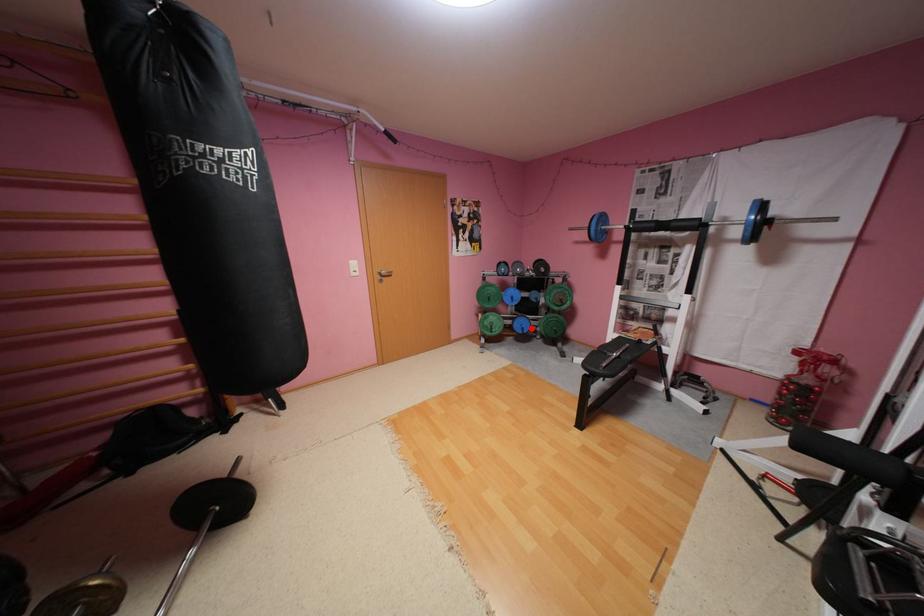
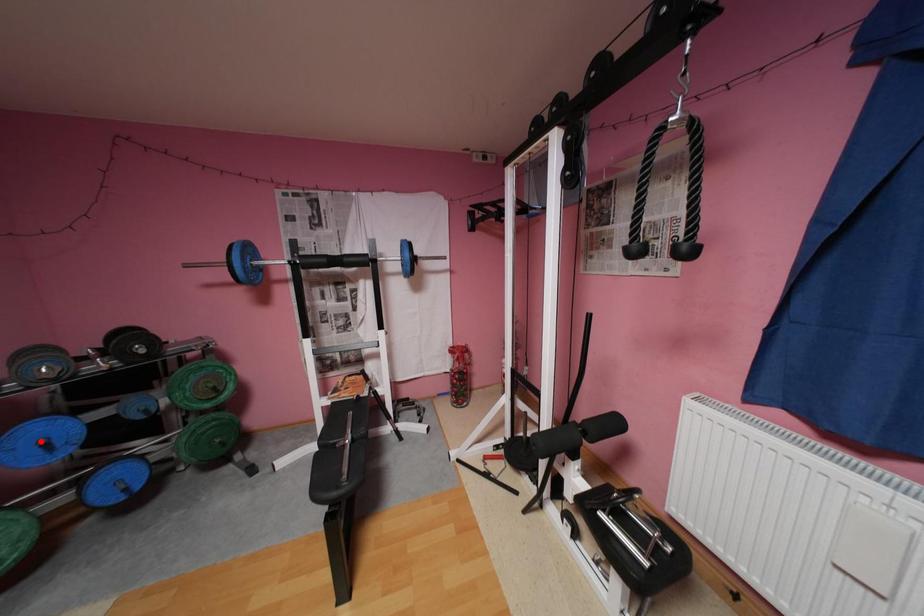
I am providing you with two images of the same scene from different viewpoints. A red point is marked on the first image and another point is marked on the second image. Does the point marked in image1 correspond to the same location as the one in image2?

No